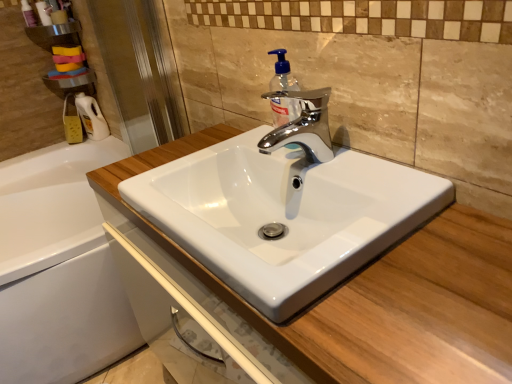
Question: Is transparent plastic soap dispenser at center inside the boundaries of transparent plastic screen door at left, or outside?

Choices:
 (A) inside
 (B) outside

Answer: (B)

Question: From the image's perspective, is transparent plastic soap dispenser at center above or below transparent plastic screen door at left?

Choices:
 (A) below
 (B) above

Answer: (A)

Question: Based on their relative distances, which object is nearer to the metallic silver shelf at upper left?

Choices:
 (A) transparent plastic screen door at left
 (B) white glossy sink at center
 (C) transparent plastic soap dispenser at center
 (D) matte white lotion at upper left
 (E) white glossy bathtub at lower left

Answer: (D)

Question: Which is nearer to the white glossy sink at center?

Choices:
 (A) white glossy bathtub at lower left
 (B) transparent plastic soap dispenser at center
 (C) transparent plastic screen door at left
 (D) metallic silver shelf at upper left
 (E) matte white lotion at upper left

Answer: (B)